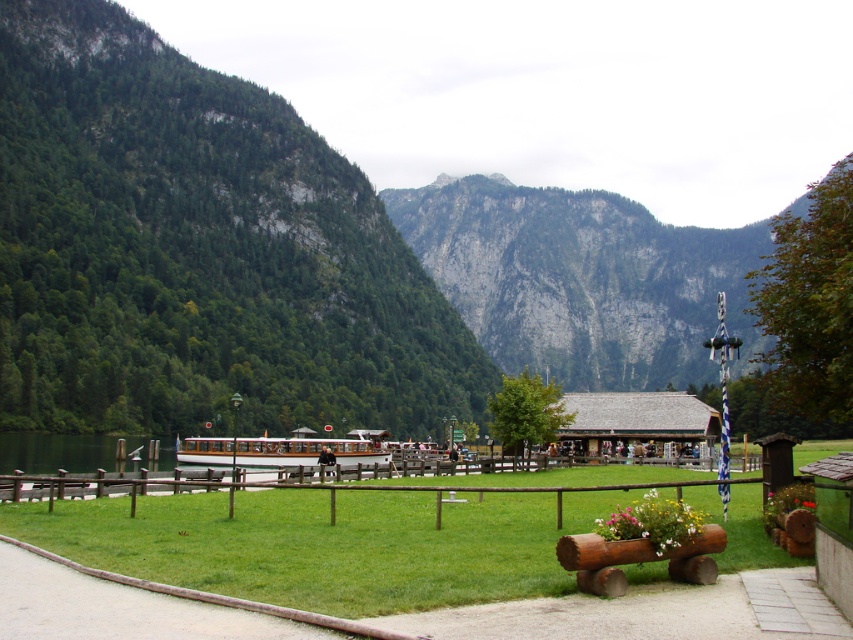
Is concrete sidewalk at lower center below clear water at dock left?

Incorrect, concrete sidewalk at lower center is not positioned below clear water at dock left.

What do you see at coordinates (115, 608) in the screenshot?
I see `concrete sidewalk at lower center` at bounding box center [115, 608].

Find the location of a particular element. This screenshot has height=640, width=853. concrete sidewalk at lower center is located at coordinates (115, 608).

Who is taller, green forested mountain at center or green grass at center?

With more height is green forested mountain at center.

Does point (82, 380) lie behind point (68, 545)?

Yes.

Is point (45, 260) closer to viewer compared to point (96, 522)?

No, (45, 260) is behind (96, 522).

Where is `green forested mountain at center`? This screenshot has height=640, width=853. green forested mountain at center is located at coordinates (196, 252).

Consider the image. Between green grass at center and clear water at dock left, which one has less height?

Standing shorter between the two is green grass at center.

Who is more forward, (128,522) or (146,464)?

Point (128,522)

You are a GUI agent. You are given a task and a screenshot of the screen. Output one action in this format:
    pyautogui.click(x=<x>, y=<y>)
    Task: Click on the green grass at center
    The width and height of the screenshot is (853, 640).
    Given the screenshot: What is the action you would take?
    pyautogui.click(x=325, y=545)